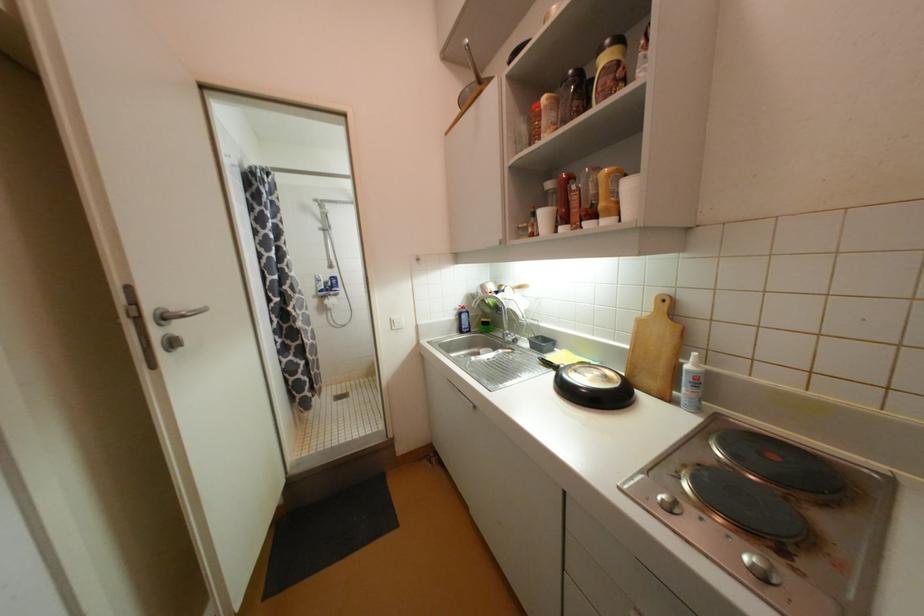
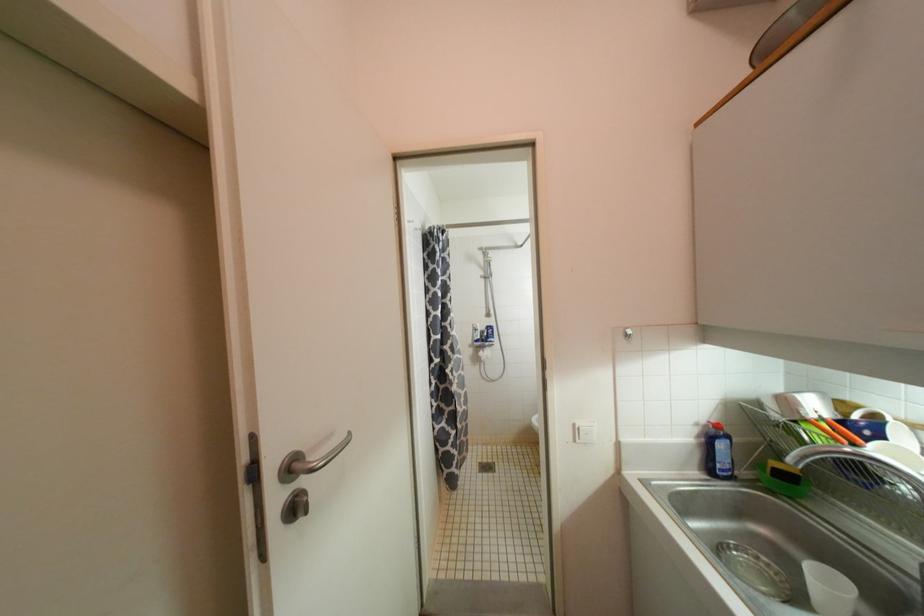
Question: Based on the continuous images, in which direction is the camera rotating? Reply with the corresponding letter.

Choices:
 (A) Left
 (B) Right
 (C) Up
 (D) Down

Answer: (A)